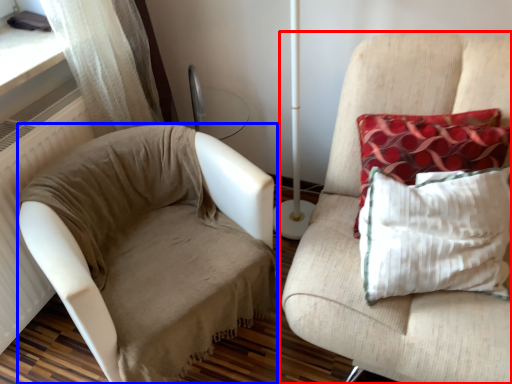
Question: Which point is further to the camera, furniture (highlighted by a red box) or studio couch (highlighted by a blue box)?

Choices:
 (A) furniture
 (B) studio couch

Answer: (B)